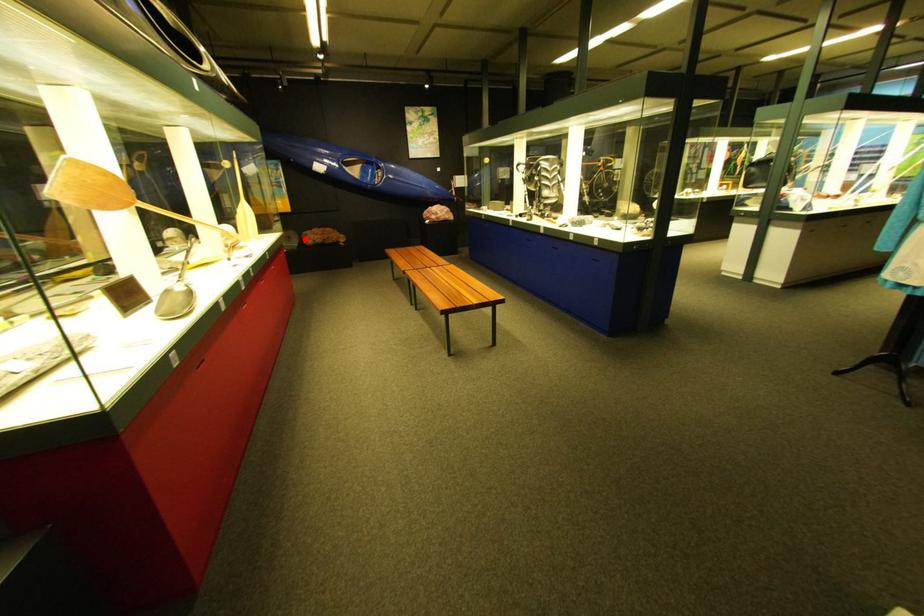
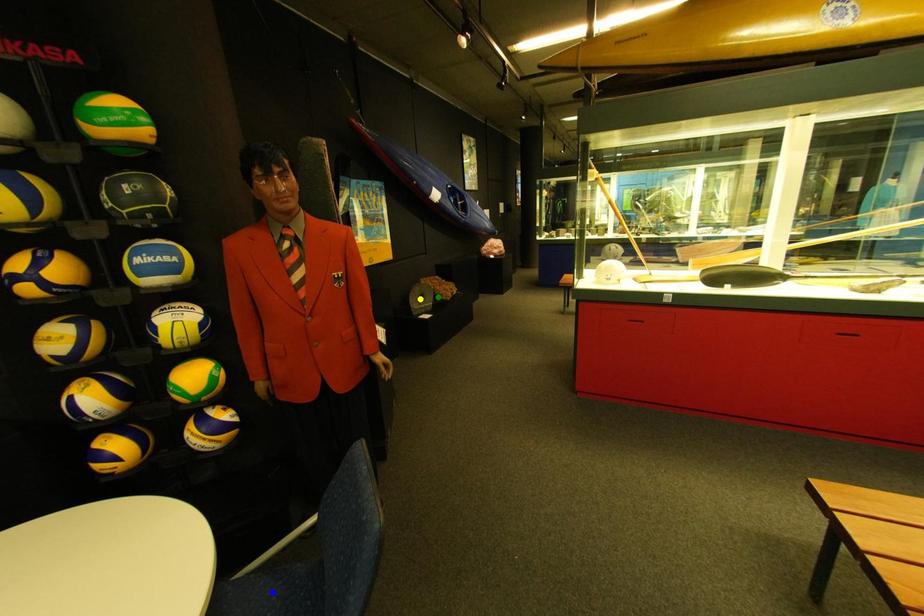
Question: I am providing you with two images of the same scene from different viewpoints. A red point is marked on the first image. You are given multiple points on the second image. Which spot in image 2 lines up with the point in image 1?

Choices:
 (A) blue point
 (B) green point
 (C) yellow point

Answer: (B)